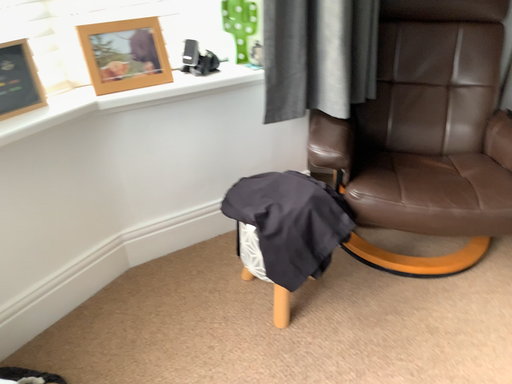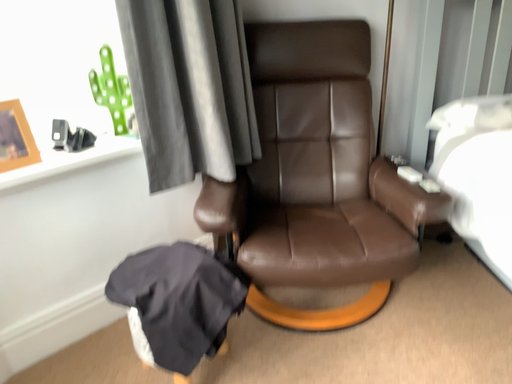
Question: How did the camera likely rotate when shooting the video?

Choices:
 (A) rotated upward
 (B) rotated downward

Answer: (A)